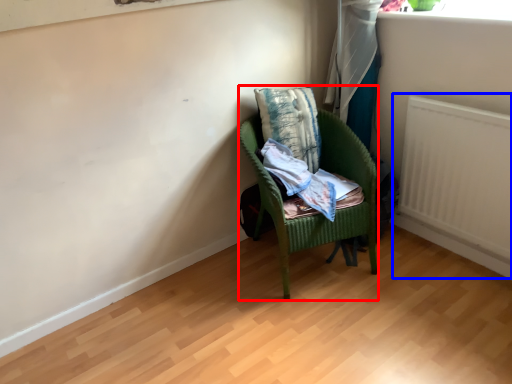
Question: Which of the following is the closest to the observer, chair (highlighted by a red box) or radiator (highlighted by a blue box)?

Choices:
 (A) chair
 (B) radiator

Answer: (B)